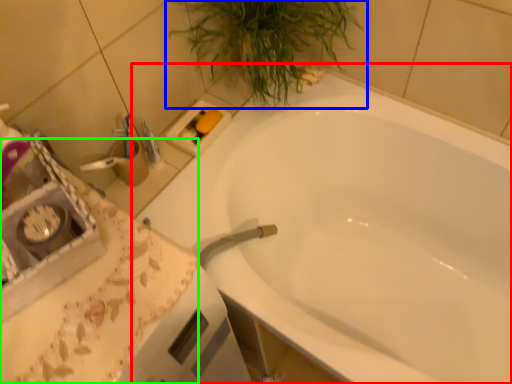
Question: Which object is the closest to the bathtub (highlighted by a red box)? Choose among these: houseplant (highlighted by a blue box) or counter top (highlighted by a green box).

Choices:
 (A) houseplant
 (B) counter top

Answer: (A)